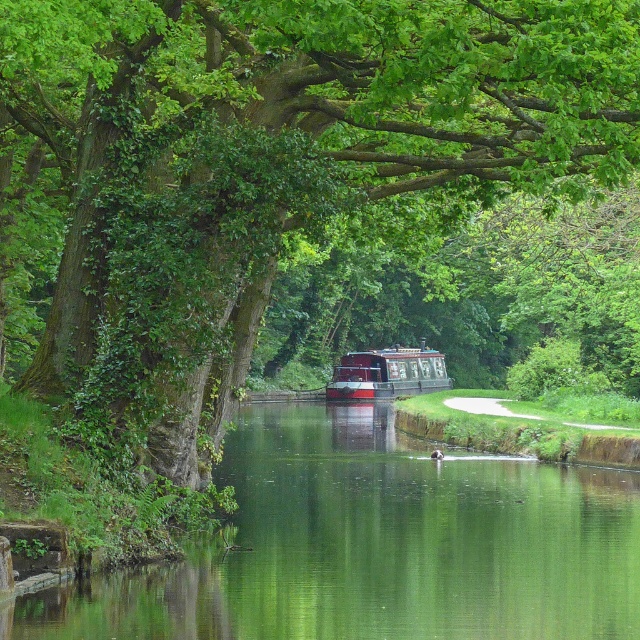
You are standing at the edge of the canal and see two points marked in the image. Which point, point (348,477) or point (364,396), is closer to you?

Point (348,477) is closer to the camera than point (364,396), so it is closer to you.

You are a photographer trying to capture the reflection of the tree in the water. Since the green smooth water at center is larger than the polished wood boat at center, which object would provide a better surface for reflecting the tree?

The green smooth water at center would provide a better surface for reflecting the tree because it is larger in size than the polished wood boat at center, offering a wider area to capture the reflection.

You are a small toy boat that is 1.2 meters long. You want to sail from the green smooth water at center to the polished wood boat at center. Can you fit through the space between them?

The green smooth water at center might be wider than polished wood boat at center, so there is a possibility that the space between them is sufficient for the toy boat to pass through. However, since the exact width isn not provided, it is recommended to proceed cautiously.